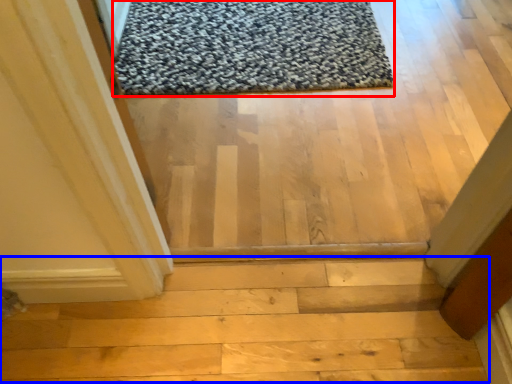
Question: Which object appears closest to the camera in this image, mat (highlighted by a red box) or stairwell (highlighted by a blue box)?

Choices:
 (A) mat
 (B) stairwell

Answer: (B)